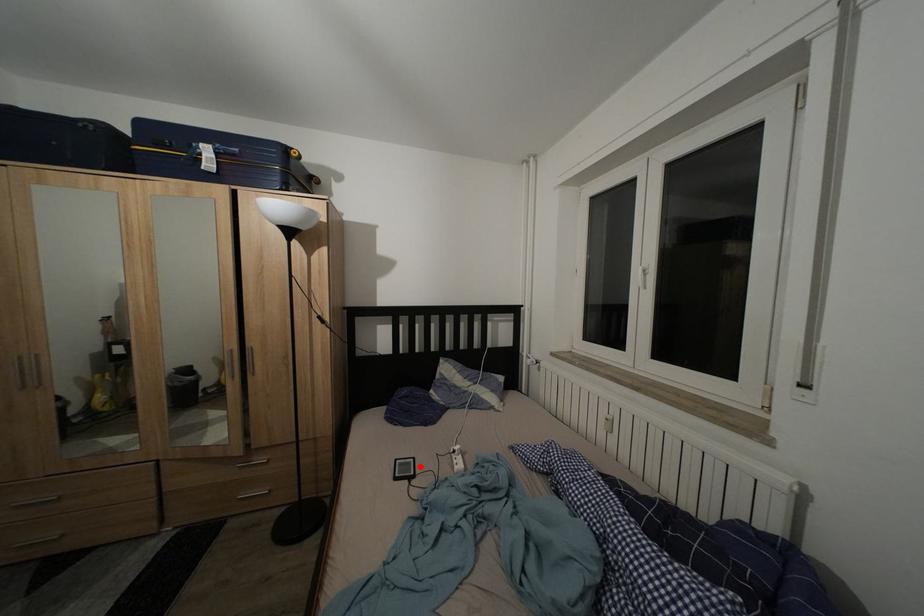
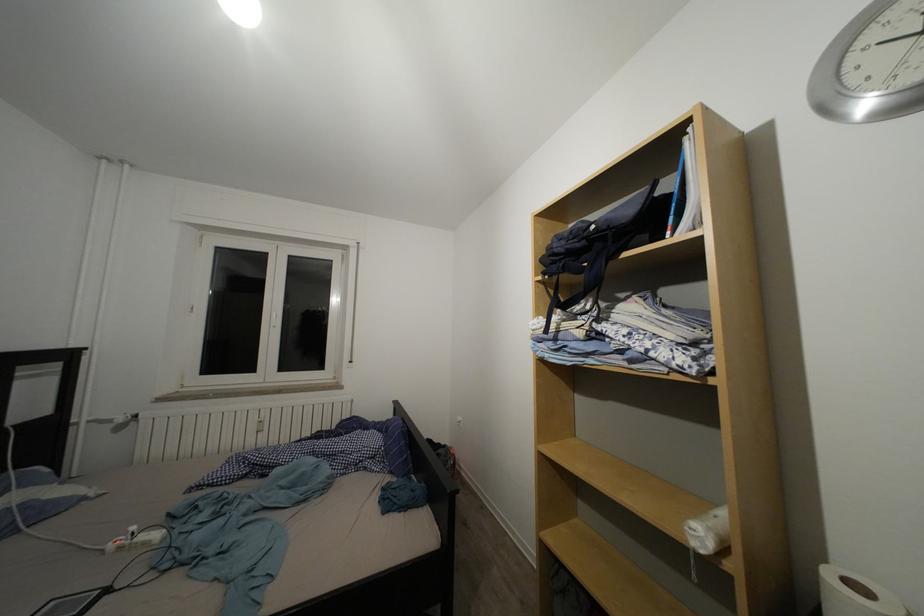
Where in the second image is the point corresponding to the highlighted location from the first image?

(61, 610)